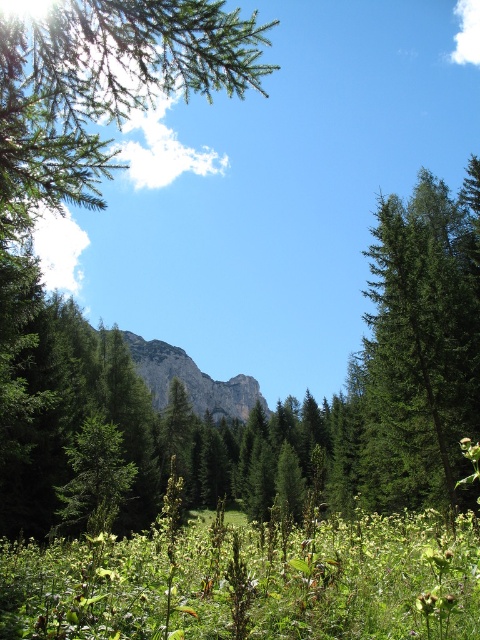
Question: Can you confirm if green matte tree at right is smaller than rugged stone mountain at center?

Choices:
 (A) no
 (B) yes

Answer: (B)

Question: Which point is closer to the camera taking this photo?

Choices:
 (A) (79, 144)
 (B) (368, 492)
 (C) (137, 362)

Answer: (A)

Question: Can you confirm if green needle-like branches at upper left is wider than green matte tree at right?

Choices:
 (A) yes
 (B) no

Answer: (A)

Question: Which point is closer to the camera taking this photo?

Choices:
 (A) (117, 113)
 (B) (444, 397)
 (C) (208, 385)

Answer: (A)

Question: From the image, what is the correct spatial relationship of green matte tree at right in relation to rugged stone mountain at center?

Choices:
 (A) below
 (B) above

Answer: (B)

Question: Which point is farther to the camera?

Choices:
 (A) green needle-like branches at upper left
 (B) rugged stone mountain at center
 (C) green matte tree at right

Answer: (B)